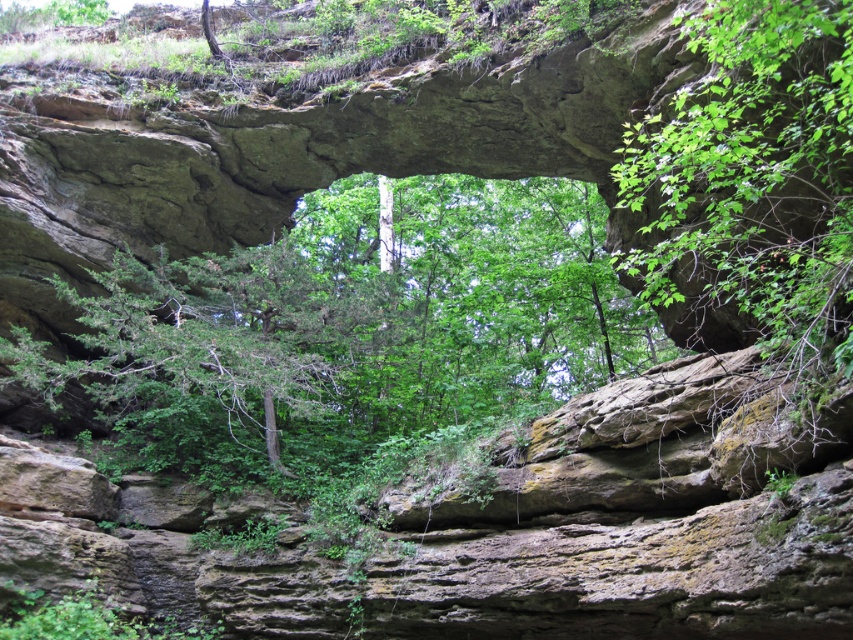
You are standing at the base of the rock arch and see two green leafy trees. Which tree is closer to you, the green leafy tree at center or the green leafy tree at upper right?

The green leafy tree at center is closer because it is positioned over the green leafy tree at upper right, meaning it blocks the view of the latter, indicating it is in front.

You are standing at the base of the rock arch and see two green leafy trees. Which tree is closer to your left side, the green leafy tree at center or the green leafy tree at upper right?

The green leafy tree at center is positioned on the left side of green leafy tree at upper right, so the green leafy tree at center is closer to your left side.

You are standing at the base of the rock arch and want to place a 4.5 meter long wooden bridge between the green leafy tree at center and the green leafy tree at upper right. Will the bridge be long enough to connect both trees?

The distance between the green leafy tree at center and the green leafy tree at upper right is 3.78 meters. Since the bridge is 4.5 meters long, it is longer than the distance between the trees, so the bridge will be long enough to connect both trees.